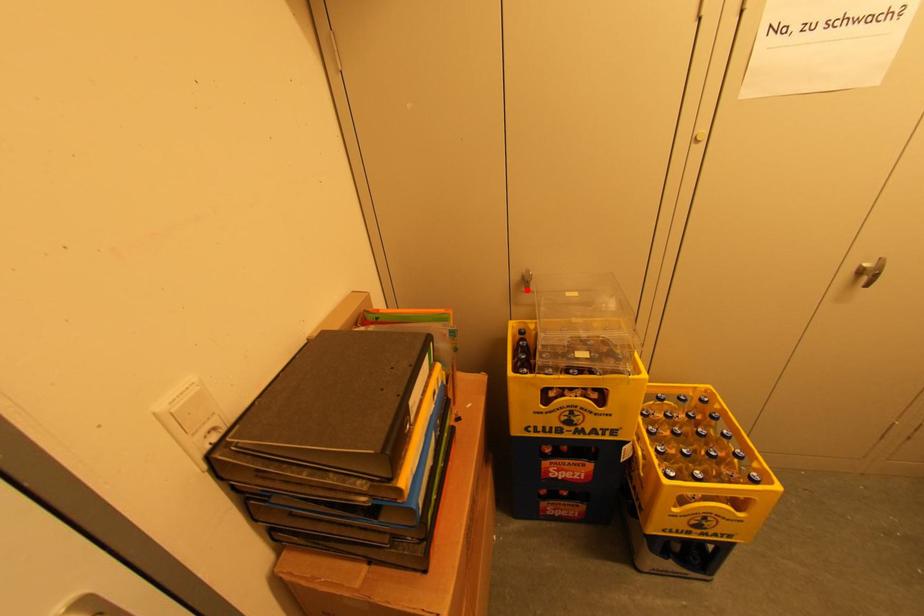
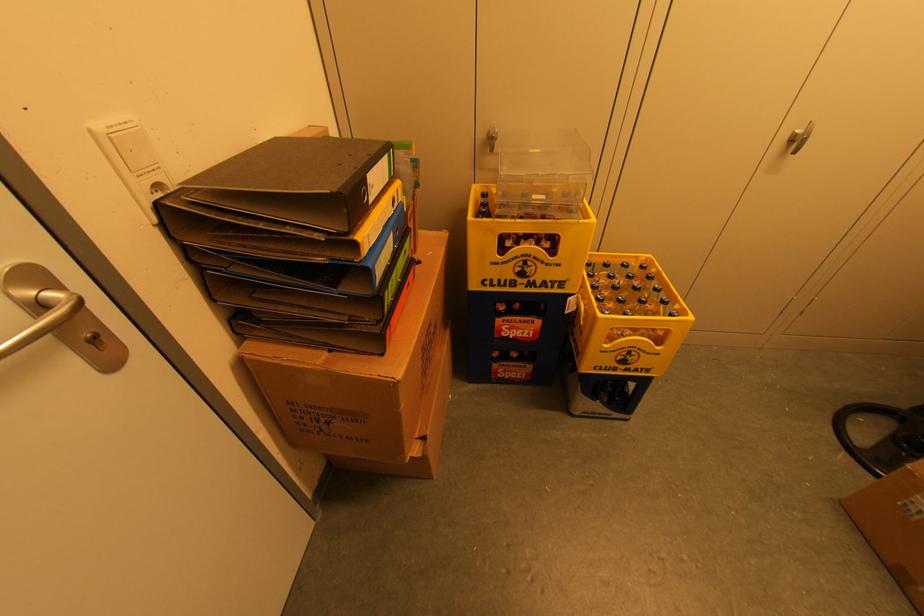
Where in the second image is the point corresponding to the highlighted location from the first image?

(491, 150)